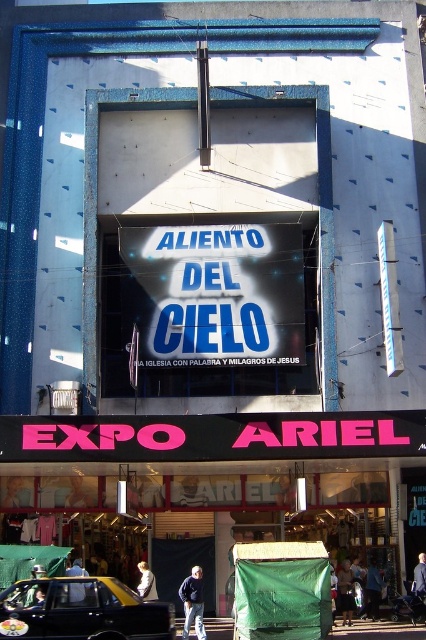
Who is shorter, pink plastic sign at center or dark blue jacket at center?

dark blue jacket at center is shorter.

Is point (267, 449) farther from viewer compared to point (189, 580)?

No.

I want to click on pink plastic sign at center, so click(x=218, y=484).

Who is positioned more to the right, dark blue jacket at center or blue fabric at center?

blue fabric at center

Is dark blue jacket at center thinner than blue fabric at center?

No.

I want to click on dark blue jacket at center, so click(x=192, y=602).

Who is taller, green fabric bag at center or light brown leather jacket at lower left?

With more height is light brown leather jacket at lower left.

Does green fabric bag at center have a greater width compared to light brown leather jacket at lower left?

No.

What do you see at coordinates (345, 592) in the screenshot?
I see `green fabric bag at center` at bounding box center [345, 592].

I want to click on green fabric bag at center, so click(345, 592).